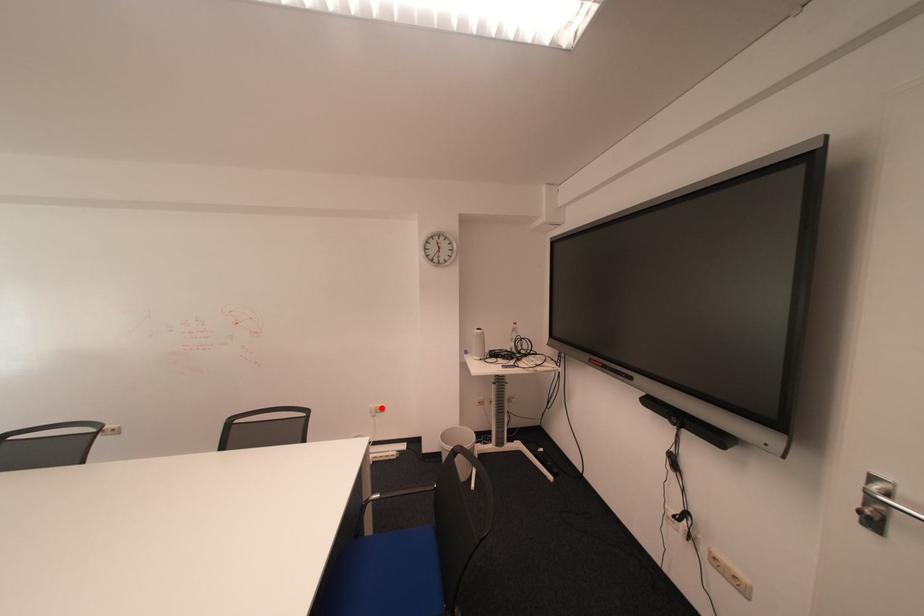
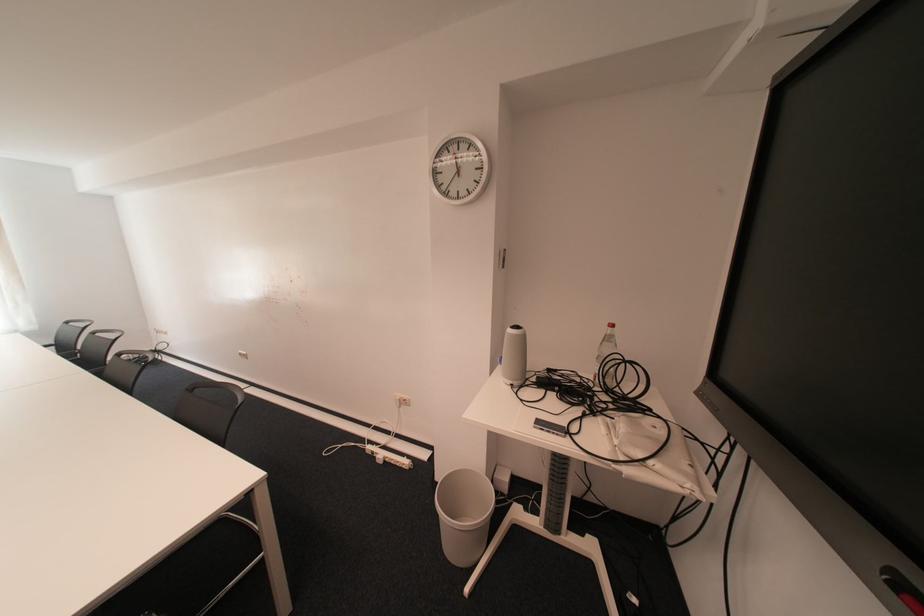
Locate, in the second image, the point that corresponds to the highlighted location in the first image.

(407, 397)